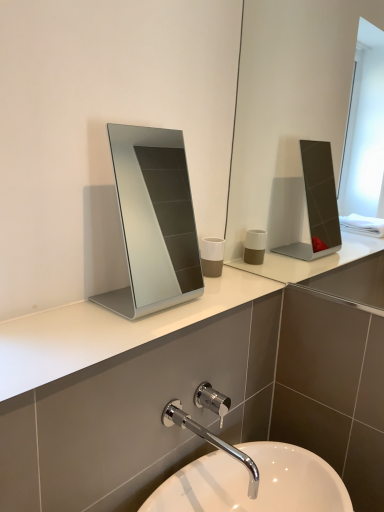
Question: Considering the relative positions of silver metallic mirror at center and chrome metallic faucet at lower center in the image provided, is silver metallic mirror at center to the left of chrome metallic faucet at lower center from the viewer's perspective?

Choices:
 (A) no
 (B) yes

Answer: (B)

Question: From a real-world perspective, is silver metallic mirror at center on top of chrome metallic faucet at lower center?

Choices:
 (A) yes
 (B) no

Answer: (A)

Question: Is silver metallic mirror at center facing towards chrome metallic faucet at lower center?

Choices:
 (A) no
 (B) yes

Answer: (A)

Question: Is silver metallic mirror at center smaller than chrome metallic faucet at lower center?

Choices:
 (A) yes
 (B) no

Answer: (B)

Question: Does silver metallic mirror at center have a greater height compared to chrome metallic faucet at lower center?

Choices:
 (A) yes
 (B) no

Answer: (A)

Question: Considering the relative positions of silver metallic mirror at center and chrome metallic faucet at lower center in the image provided, is silver metallic mirror at center behind chrome metallic faucet at lower center?

Choices:
 (A) yes
 (B) no

Answer: (A)

Question: Is silver metallic mirror at center shorter than white matte cup at center?

Choices:
 (A) no
 (B) yes

Answer: (A)

Question: Can you confirm if silver metallic mirror at center is thinner than white matte cup at center?

Choices:
 (A) yes
 (B) no

Answer: (B)

Question: From the image's perspective, is silver metallic mirror at center located above white matte cup at center?

Choices:
 (A) yes
 (B) no

Answer: (A)

Question: Is silver metallic mirror at center at the right side of white matte cup at center?

Choices:
 (A) yes
 (B) no

Answer: (B)

Question: Is silver metallic mirror at center bigger than white matte cup at center?

Choices:
 (A) yes
 (B) no

Answer: (A)

Question: Does silver metallic mirror at center lie in front of white matte cup at center?

Choices:
 (A) yes
 (B) no

Answer: (A)

Question: From the image's perspective, is white glossy sink at lower center below silver metallic mirror at center?

Choices:
 (A) no
 (B) yes

Answer: (B)